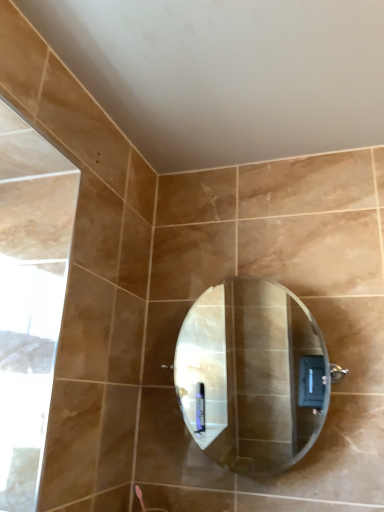
The width and height of the screenshot is (384, 512). What do you see at coordinates (252, 376) in the screenshot?
I see `polished silver mirror at center` at bounding box center [252, 376].

The image size is (384, 512). In order to click on polished silver mirror at center in this screenshot , I will do `click(252, 376)`.

In order to face polished silver mirror at center, should I rotate leftwards or rightwards?

To align with it, rotate right about 5.842°.

The image size is (384, 512). I want to click on polished silver mirror at center, so click(x=252, y=376).